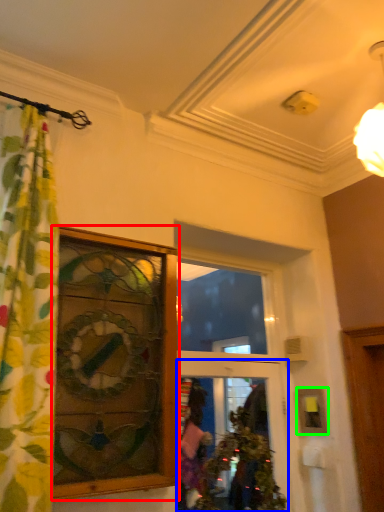
Question: Considering the real-world distances, which object is closest to window (highlighted by a red box)? door (highlighted by a blue box) or picture frame (highlighted by a green box).

Choices:
 (A) door
 (B) picture frame

Answer: (A)